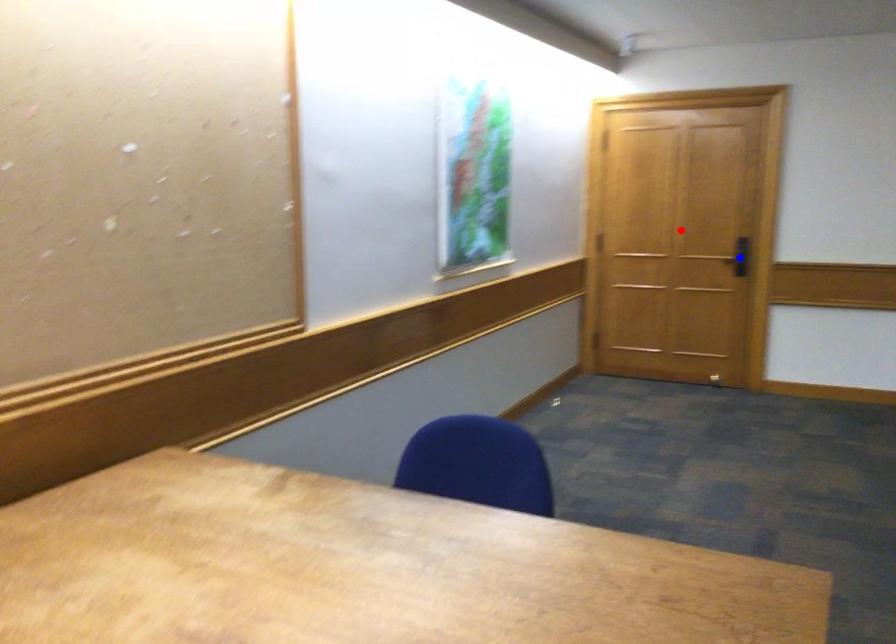
Question: In the image, two points are highlighted. Which point is nearer to the camera? Reply with the corresponding letter.

Choices:
 (A) blue point
 (B) red point

Answer: (A)